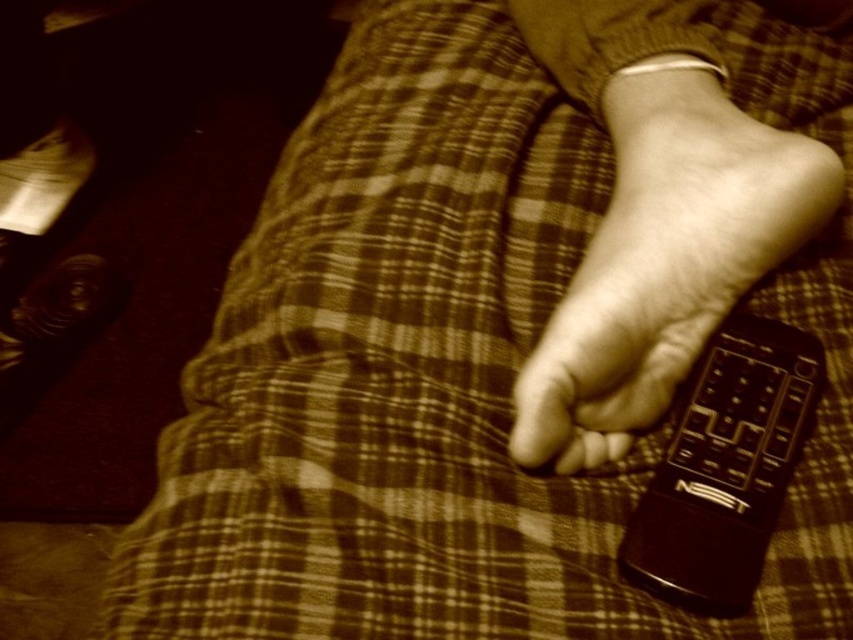
Is matte black remote at lower right positioned before black plastic remote at lower right?

No, matte black remote at lower right is behind black plastic remote at lower right.

Between matte black remote at lower right and black plastic remote at lower right, which one has less height?

black plastic remote at lower right

Who is more forward, [637,308] or [648,556]?

Point [648,556] is more forward.

Where is `matte black remote at lower right`? The height and width of the screenshot is (640, 853). matte black remote at lower right is located at coordinates (664, 268).